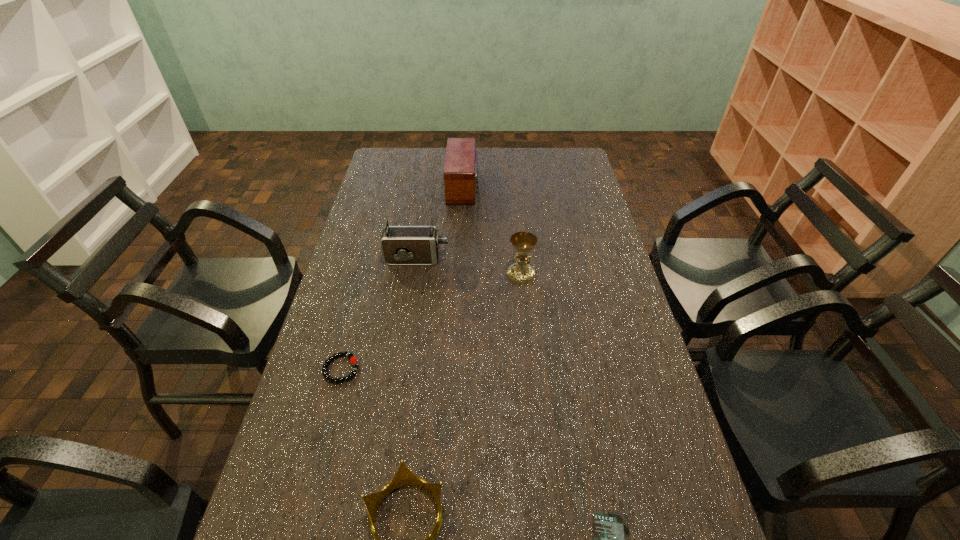
Locate an element on the screen. This screenshot has width=960, height=540. camcorder is located at coordinates (401, 245).

The width and height of the screenshot is (960, 540). In order to click on the farthest object in this screenshot , I will do `click(461, 162)`.

Identify the location of chalice. point(523,243).

Identify the location of bracelet. (353, 360).

Find the location of a particular element. the fifth tallest object is located at coordinates (353, 360).

Find the location of `vacant region located at the lens of the camcorder`. vacant region located at the lens of the camcorder is located at coordinates (560, 259).

The width and height of the screenshot is (960, 540). What are the coordinates of `free spot located 0.070m on the front-facing side of the farthest object` in the screenshot? It's located at (495, 186).

The width and height of the screenshot is (960, 540). I want to click on blank space located 0.390m on the left of the fifth object from left to right, so [x=388, y=274].

Locate an element on the screen. Image resolution: width=960 pixels, height=540 pixels. free space located on the right of the bracelet is located at coordinates (415, 369).

In order to click on object that is at the far edge in this screenshot , I will do `click(461, 162)`.